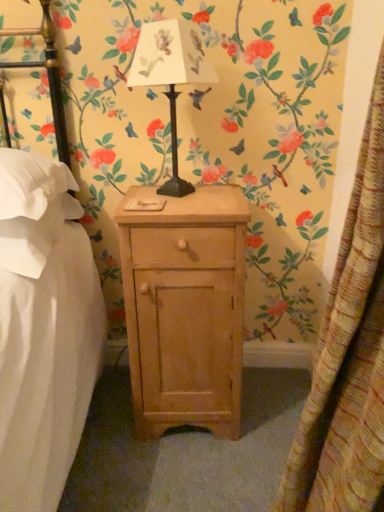
This screenshot has width=384, height=512. I want to click on vacant space to the left of light wood nightstand at center, so click(108, 428).